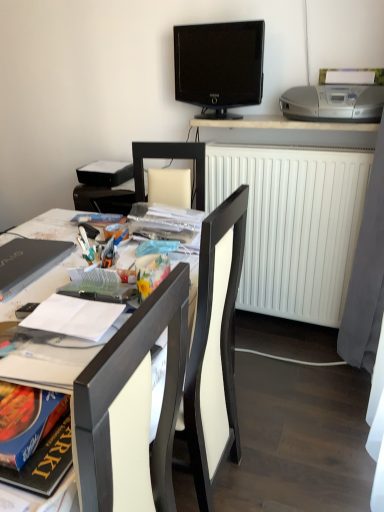
The height and width of the screenshot is (512, 384). What do you see at coordinates (41, 287) in the screenshot?
I see `matte black desk at center, which is the 1th desk in bottom-to-top order` at bounding box center [41, 287].

At what (x,y) coordinates should I click in order to perform the action: click on white glossy desk at upper center, acting as the first desk starting from the back. Please return your answer as a coordinate pair (x, y). The image size is (384, 512). Looking at the image, I should click on (287, 132).

Find the location of a particular element. black glossy tv at upper center is located at coordinates (219, 66).

Describe the element at coordinates (333, 103) in the screenshot. I see `silver plastic printer at upper right` at that location.

The width and height of the screenshot is (384, 512). Find the location of `silver plastic printer at upper right`. silver plastic printer at upper right is located at coordinates (333, 103).

Where is `white paper at left`? This screenshot has width=384, height=512. white paper at left is located at coordinates (74, 316).

Can you confirm if matte black laptop at left is taller than hardcover book at center-left?

No, matte black laptop at left is not taller than hardcover book at center-left.

Measure the distance between matte black laptop at left and hardcover book at center-left.

They are 9.92 inches apart.

Can you confirm if matte black laptop at left is bigger than hardcover book at center-left?

Correct, matte black laptop at left is larger in size than hardcover book at center-left.

Considering the positions of points (32, 242) and (101, 294), is point (32, 242) closer to camera compared to point (101, 294)?

No, (32, 242) is further to viewer.

Is white paper at left at the back of matte black laptop at left?

Yes, white paper at left is at the back of matte black laptop at left.

Looking at this image, is matte black laptop at left not near white paper at left?

No, there isn't a large distance between matte black laptop at left and white paper at left.

Identify the location of magazine that is on the right side of matte black laptop at left. This screenshot has width=384, height=512. (74, 316).

From a real-world perspective, is matte black laptop at left above or below white paper at left?

From a real-world perspective, matte black laptop at left is physically below white paper at left.

Does point (334, 123) come farther from viewer compared to point (6, 234)?

Yes, point (334, 123) is farther from viewer.

Considering the relative sizes of white glossy desk at upper center, arranged as the second desk when ordered from the bottom, and matte black desk at center, marked as the 2th desk in a back-to-front arrangement, in the image provided, is white glossy desk at upper center, arranged as the second desk when ordered from the bottom, thinner than matte black desk at center, marked as the 2th desk in a back-to-front arrangement,?

Correct, the width of white glossy desk at upper center, arranged as the second desk when ordered from the bottom, is less than that of matte black desk at center, marked as the 2th desk in a back-to-front arrangement.

Between white glossy desk at upper center, which is counted as the second desk, starting from the front, and matte black desk at center, the first desk viewed from the front, which one has more height?

matte black desk at center, the first desk viewed from the front, is taller.

Consider the image. From a real-world perspective, is white glossy desk at upper center, acting as the first desk starting from the back, beneath matte black desk at center, marked as the first desk in a left-to-right arrangement?

No, from a real-world perspective, white glossy desk at upper center, acting as the first desk starting from the back, is not under matte black desk at center, marked as the first desk in a left-to-right arrangement.

Where is `paperback book below the silver plastic printer at upper right (from a real-world perspective)`? The height and width of the screenshot is (512, 384). paperback book below the silver plastic printer at upper right (from a real-world perspective) is located at coordinates click(x=98, y=286).

How distant is hardcover book at center-left from silver plastic printer at upper right?

A distance of 1.22 meters exists between hardcover book at center-left and silver plastic printer at upper right.

In the scene shown: Considering the relative sizes of hardcover book at center-left and silver plastic printer at upper right in the image provided, is hardcover book at center-left smaller than silver plastic printer at upper right?

Indeed, hardcover book at center-left has a smaller size compared to silver plastic printer at upper right.

Is hardcover book at center-left not inside silver plastic printer at upper right?

hardcover book at center-left is positioned outside silver plastic printer at upper right.

Considering the positions of objects white matte radiator at right and matte black laptop at left in the image provided, who is behind, white matte radiator at right or matte black laptop at left?

white matte radiator at right is behind.

Who is taller, white matte radiator at right or matte black laptop at left?

With more height is white matte radiator at right.

Does point (320, 178) come closer to viewer compared to point (64, 250)?

No, (320, 178) is behind (64, 250).

At what (x,y) coordinates should I click in order to perform the action: click on laptop located underneath the black glossy tv at upper center (from a real-world perspective). Please return your answer as a coordinate pair (x, y). Image resolution: width=384 pixels, height=512 pixels. Looking at the image, I should click on (28, 262).

Which object is further away from the camera, matte black laptop at left or black glossy tv at upper center?

Positioned behind is black glossy tv at upper center.

Between matte black laptop at left and black glossy tv at upper center, which one has smaller width?

With smaller width is black glossy tv at upper center.

From the image's perspective, is white matte radiator at right under hardcover book at center-left?

No.

At what (x,y) coordinates should I click in order to perform the action: click on paperback book that appears in front of the white matte radiator at right. Please return your answer as a coordinate pair (x, y). The width and height of the screenshot is (384, 512). Looking at the image, I should click on (98, 286).

Relative to hardcover book at center-left, is white matte radiator at right in front or behind?

white matte radiator at right is positioned farther from the viewer than hardcover book at center-left.

Is hardcover book at center-left surrounded by white matte radiator at right?

Definitely not — hardcover book at center-left is not inside white matte radiator at right.

Identify the location of laptop that is above the hardcover book at center-left (from the image's perspective). Image resolution: width=384 pixels, height=512 pixels. (28, 262).

Find the location of a particular element. laptop located on the left of white paper at left is located at coordinates (28, 262).

Which object lies further to the anchor point white paper at left, silver plastic printer at upper right or white glossy desk at upper center, the second desk from the left?

white glossy desk at upper center, the second desk from the left, is positioned further to the anchor white paper at left.

Based on their spatial positions, is matte black desk at center, which appears as the second desk when viewed from the right, or hardcover book at center-left further from white paper at left?

matte black desk at center, which appears as the second desk when viewed from the right, is positioned further to the anchor white paper at left.

Looking at this image, when comparing their distances from white paper at left, does white glossy desk at upper center, which is the 1th desk in top-to-bottom order, or matte black laptop at left seem further?

Based on the image, white glossy desk at upper center, which is the 1th desk in top-to-bottom order, appears to be further to white paper at left.

Which object lies further to the anchor point white glossy desk at upper center, which ranks as the first desk in right-to-left order, white paper at left or black matte book at upper center?

The object further to white glossy desk at upper center, which ranks as the first desk in right-to-left order, is white paper at left.

Considering their positions, is matte black laptop at left positioned closer to black matte book at upper center than white matte radiator at right?

Based on the image, white matte radiator at right appears to be nearer to black matte book at upper center.

When comparing their distances from matte black desk at center, which appears as the second desk when viewed from the right, does white matte radiator at right or black glossy tv at upper center seem closer?

white matte radiator at right lies closer to matte black desk at center, which appears as the second desk when viewed from the right, than the other object.

Based on their spatial positions, is black glossy tv at upper center or matte black laptop at left further from white paper at left?

black glossy tv at upper center.

In the scene shown: When comparing their distances from matte black desk at center, the first desk viewed from the front, does hardcover book at center-left or silver plastic printer at upper right seem closer?

hardcover book at center-left lies closer to matte black desk at center, the first desk viewed from the front, than the other object.

You are a GUI agent. You are given a task and a screenshot of the screen. Output one action in this format:
    pyautogui.click(x=<x>, y=<y>)
    Task: Click on the radiator between white paper at left and black matte book at upper center in the front-back direction
    The width and height of the screenshot is (384, 512).
    Given the screenshot: What is the action you would take?
    pyautogui.click(x=293, y=225)

In order to click on paperback book between black glossy tv at upper center and matte black desk at center, marked as the 2th desk in a back-to-front arrangement, vertically in this screenshot , I will do `click(98, 286)`.

What are the coordinates of `desk between hardcover book at center-left and white matte radiator at right in the horizontal direction` in the screenshot? It's located at click(287, 132).

The image size is (384, 512). In order to click on desk between hardcover book at center-left and black matte book at upper center along the z-axis in this screenshot , I will do `click(287, 132)`.